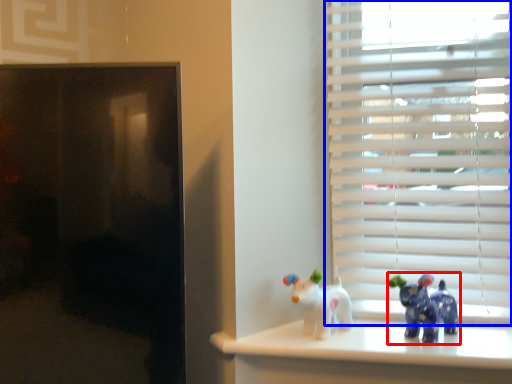
Question: Which point is closer to the camera, toy (highlighted by a red box) or window blind (highlighted by a blue box)?

Choices:
 (A) toy
 (B) window blind

Answer: (A)